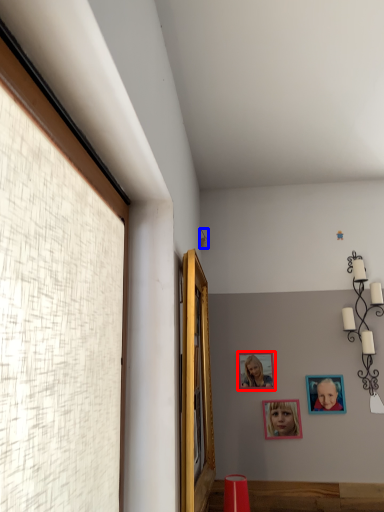
Question: Which of the following is the farthest to the observer, picture frame (highlighted by a red box) or lamp (highlighted by a blue box)?

Choices:
 (A) picture frame
 (B) lamp

Answer: (B)